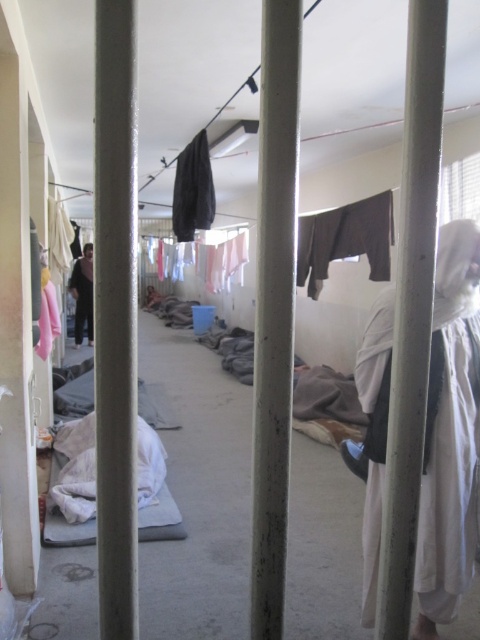
You are a delivery person who needs to hang a new cloth in the corridor. You have a new cloth that is 1.2 meters wide. You see the white cloth at right and the dark gray fabric at center. Which existing cloth should you compare the width of your new cloth with to decide where to place it?

You should compare the width of your new cloth with the white cloth at right because the white cloth at right might be wider than dark gray fabric at center.

You are a prisoner in the detention facility and need to hang your laundry. There is a metallic gray pole at center and a dark gray fabric robe at center in your cell. Which object is closer to the left wall?

The dark gray fabric robe at center is closer to the left wall because the metallic gray pole at center is to the right of it.

You are standing in a detention facility corridor and need to locate the metallic gray pole at center. According to the coordinates provided, where exactly is the metallic gray pole positioned in the scene?

The metallic gray pole at center is located at coordinates point 0.487 on the x axis and 0.858 on the y axis.